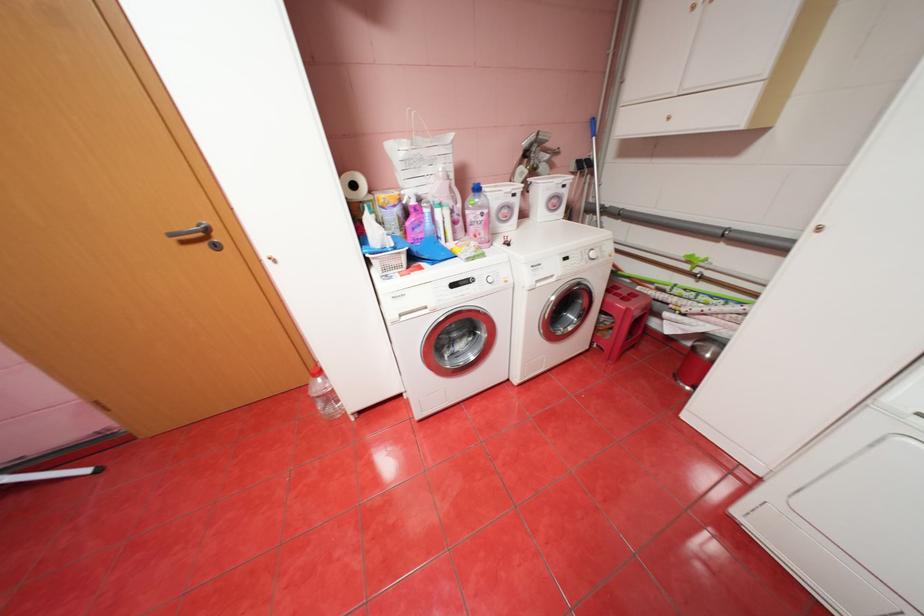
Describe the element at coordinates (197, 236) in the screenshot. I see `a silver door handle` at that location.